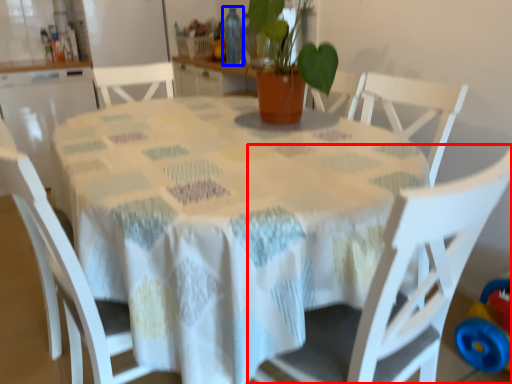
Question: Among these objects, which one is nearest to the camera, chair (highlighted by a red box) or bottle (highlighted by a blue box)?

Choices:
 (A) chair
 (B) bottle

Answer: (A)